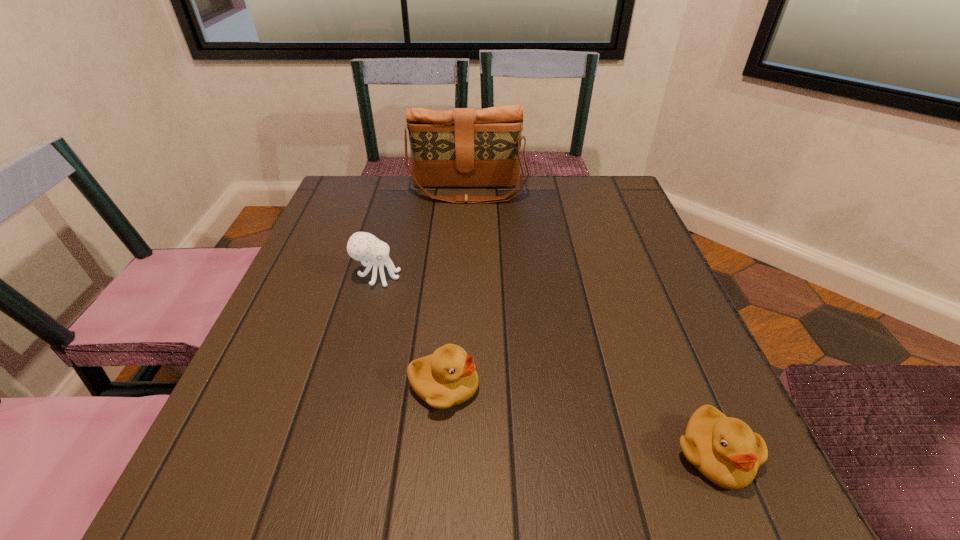
Identify the location of vacant space located on the front-facing side of the third farthest object. (606, 387).

The width and height of the screenshot is (960, 540). I want to click on object that is positioned at the far edge, so pyautogui.click(x=464, y=147).

In order to click on object at the near edge in this screenshot , I will do `click(725, 450)`.

Identify the location of object that is at the left edge. (362, 246).

Image resolution: width=960 pixels, height=540 pixels. Identify the location of object present at the right edge. (725, 450).

Where is `object located at the near right corner`? object located at the near right corner is located at coordinates (x=725, y=450).

Where is `vacant area at the far edge of the desktop`? vacant area at the far edge of the desktop is located at coordinates (445, 216).

At what (x,y) coordinates should I click in order to perform the action: click on vacant area at the near edge of the desktop. Please return your answer as a coordinate pair (x, y). The width and height of the screenshot is (960, 540). Looking at the image, I should click on (513, 495).

This screenshot has height=540, width=960. In the image, there is a desktop. In order to click on vacant space at the left edge in this screenshot , I will do `click(330, 292)`.

In the image, there is a desktop. Where is `vacant space at the right edge`? vacant space at the right edge is located at coordinates (656, 443).